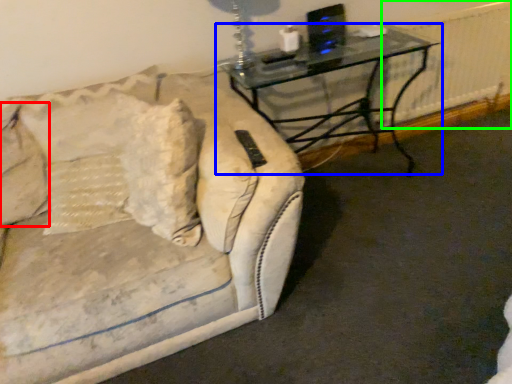
Question: Estimate the real-world distances between objects in this image. Which object is farther from pillow (highlighted by a red box), table (highlighted by a blue box) or radiator (highlighted by a green box)?

Choices:
 (A) table
 (B) radiator

Answer: (B)